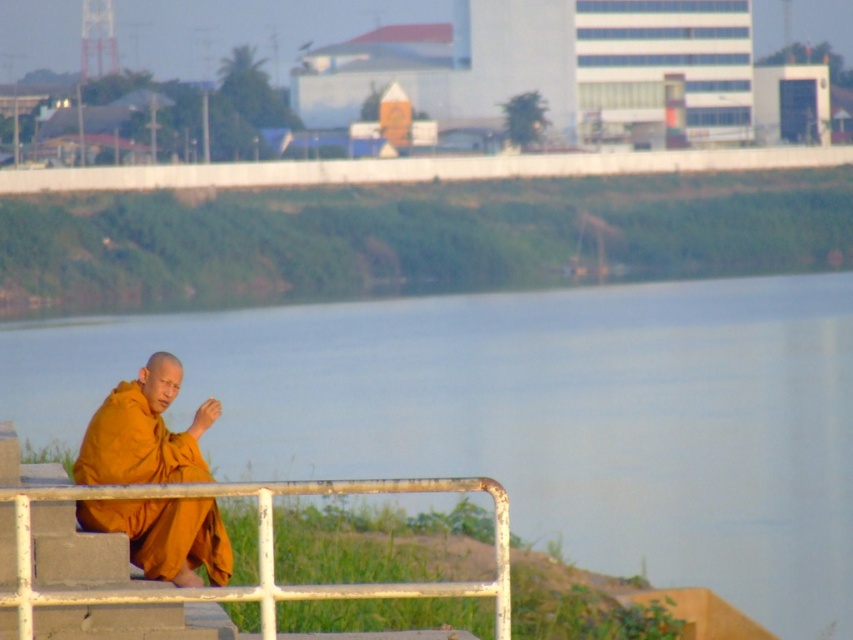
In the scene shown: Does matte orange robe at lower left come behind white metal rail at lower center?

Yes, matte orange robe at lower left is behind white metal rail at lower center.

Does matte orange robe at lower left have a lesser width compared to white metal rail at lower center?

Indeed, matte orange robe at lower left has a lesser width compared to white metal rail at lower center.

Is point (152, 385) positioned before point (311, 493)?

That is False.

At what (x,y) coordinates should I click in order to perform the action: click on matte orange robe at lower left. Please return your answer as a coordinate pair (x, y). The height and width of the screenshot is (640, 853). Looking at the image, I should click on (143, 433).

Between blue water at center and matte orange robe at lower left, which one has less height?

Standing shorter between the two is matte orange robe at lower left.

Where is `blue water at center`? The height and width of the screenshot is (640, 853). blue water at center is located at coordinates (531, 416).

Is blue water at center smaller than white metal rail at lower center?

No.

Does blue water at center appear on the left side of white metal rail at lower center?

Indeed, blue water at center is positioned on the left side of white metal rail at lower center.

Is point (636, 422) positioned behind point (54, 602)?

Yes, point (636, 422) is farther from viewer.

Where is `blue water at center`? blue water at center is located at coordinates point(531,416).